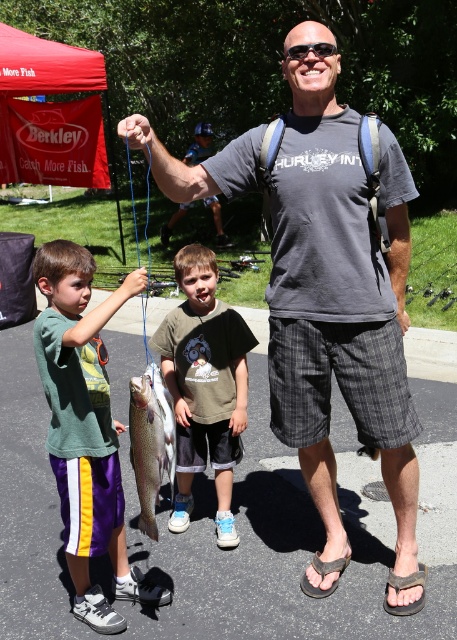
Question: Is green fabric shirt at left below shiny silver fish at center?

Choices:
 (A) no
 (B) yes

Answer: (A)

Question: Is gray cotton t-shirt at center to the right of shiny silver fish at center from the viewer's perspective?

Choices:
 (A) yes
 (B) no

Answer: (A)

Question: Observing the image, what is the correct spatial positioning of green fabric shirt at left in reference to shiny silver fish at center?

Choices:
 (A) right
 (B) left

Answer: (B)

Question: Which object is closer to the camera taking this photo?

Choices:
 (A) green fabric shirt at left
 (B) green cotton shirt at center
 (C) gray cotton t-shirt at center

Answer: (C)

Question: Which of these objects is positioned closest to the shiny silver fish at center?

Choices:
 (A) gray cotton t-shirt at center
 (B) green cotton shirt at center

Answer: (A)

Question: Which of these objects is positioned closest to the green cotton shirt at center?

Choices:
 (A) green fabric shirt at left
 (B) shiny silver fish at center
 (C) gray cotton t-shirt at center

Answer: (C)